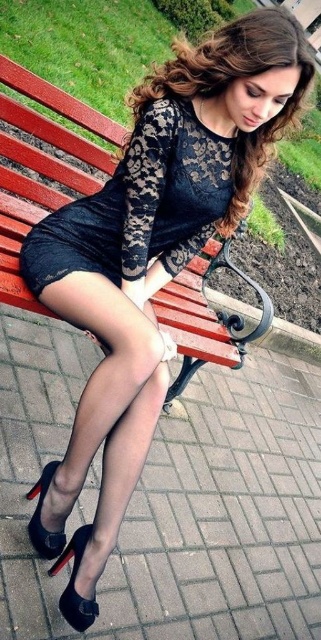
Question: Which object is positioned closest to the lace fabric dress at center?

Choices:
 (A) black sheer tights at lower center
 (B) wooden bench at center

Answer: (A)

Question: Is the position of black sheer tights at lower center more distant than that of lace fabric dress at center?

Choices:
 (A) yes
 (B) no

Answer: (B)

Question: Which point appears farthest from the camera in this image?

Choices:
 (A) (49, 269)
 (B) (239, 316)

Answer: (B)

Question: Is black sheer tights at lower center further to the viewer compared to wooden bench at center?

Choices:
 (A) yes
 (B) no

Answer: (B)

Question: Which of these objects is positioned closest to the black sheer tights at lower center?

Choices:
 (A) wooden bench at center
 (B) lace fabric dress at center

Answer: (B)

Question: Considering the relative positions of black sheer tights at lower center and wooden bench at center in the image provided, where is black sheer tights at lower center located with respect to wooden bench at center?

Choices:
 (A) right
 (B) left

Answer: (B)